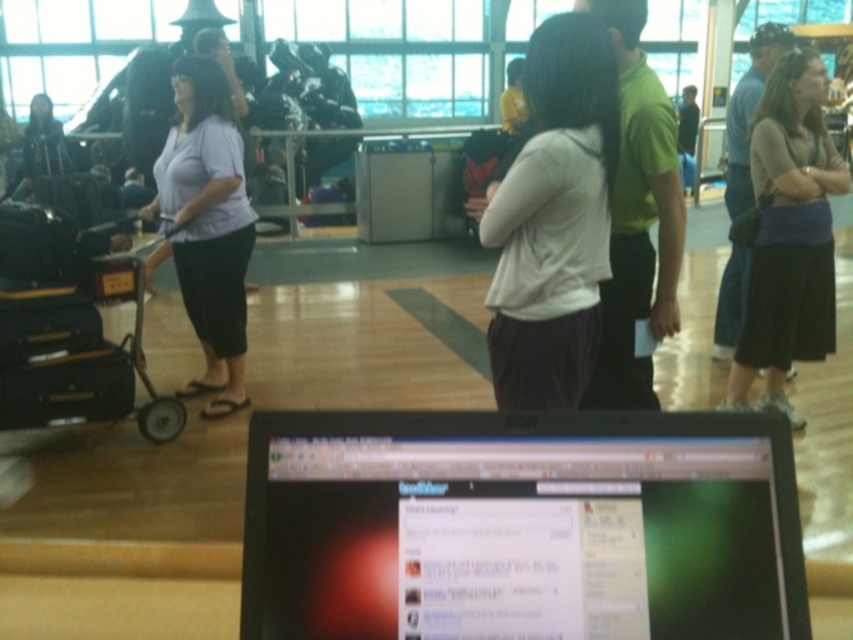
Is black glossy laptop at center bigger than dark brown skirt at right?

No.

Is black glossy laptop at center positioned behind dark brown skirt at right?

No, it is not.

The width and height of the screenshot is (853, 640). Identify the location of black glossy laptop at center. (523, 509).

Does point (799, 349) come behind point (103, 374)?

Yes.

Is dark brown skirt at right taller than black hard suitcase at left?

Indeed, dark brown skirt at right has a greater height compared to black hard suitcase at left.

This screenshot has height=640, width=853. In order to click on dark brown skirt at right in this screenshot , I will do `click(788, 234)`.

Is black glossy laptop at center further to the viewer compared to white matte shirt at center?

No, black glossy laptop at center is closer to the viewer.

Who is more distant from viewer, (721, 520) or (595, 269)?

The point (595, 269) is behind.

Is point (379, 468) behind point (564, 372)?

No, it is not.

Image resolution: width=853 pixels, height=640 pixels. What are the coordinates of `black glossy laptop at center` in the screenshot? It's located at (523, 509).